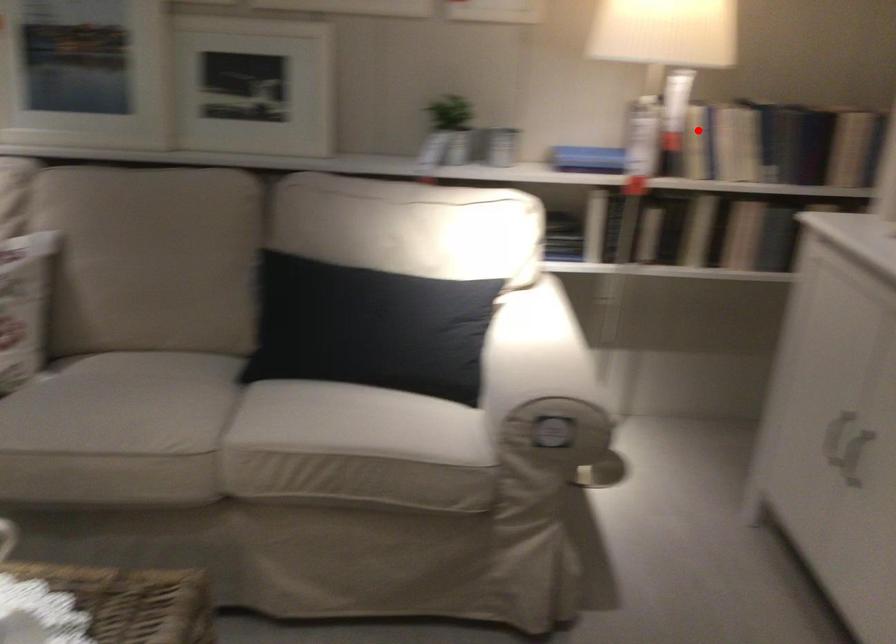
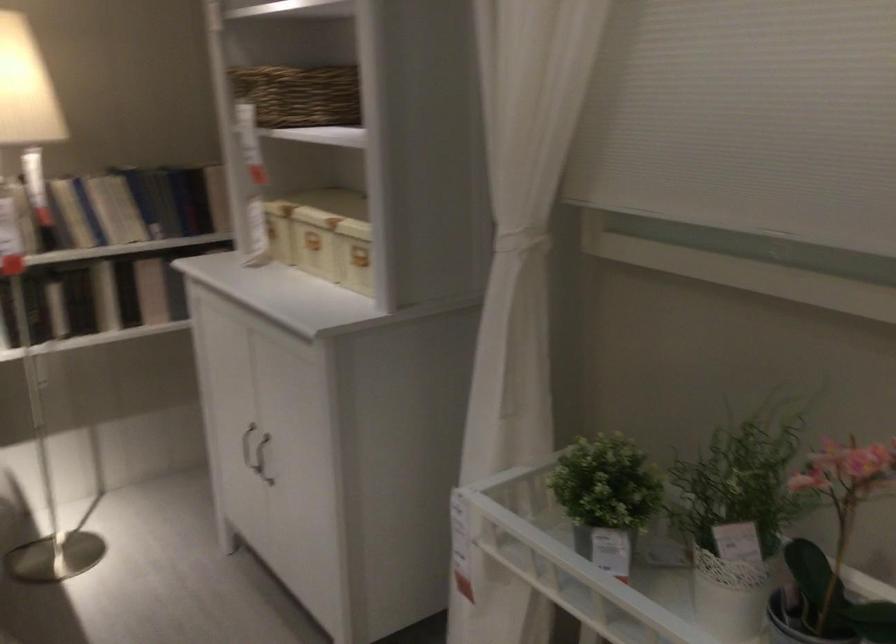
The point at the highlighted location is marked in the first image. Where is the corresponding point in the second image?

(71, 213)